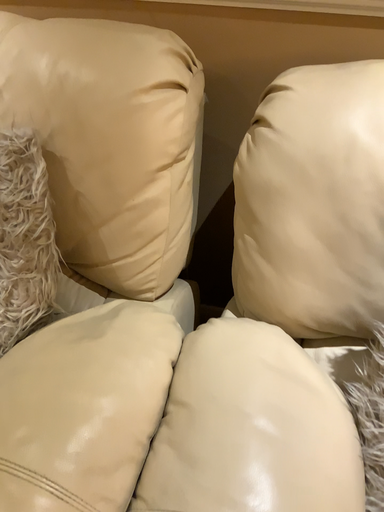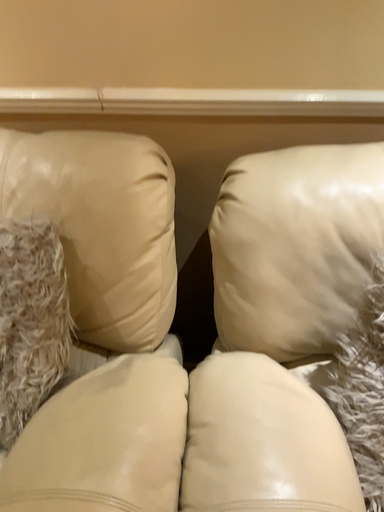
Question: Which way did the camera rotate in the video?

Choices:
 (A) rotated upward
 (B) rotated downward

Answer: (A)